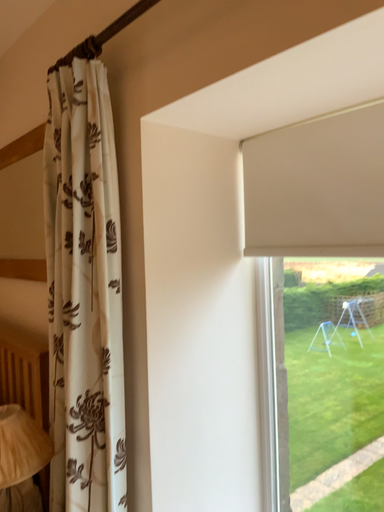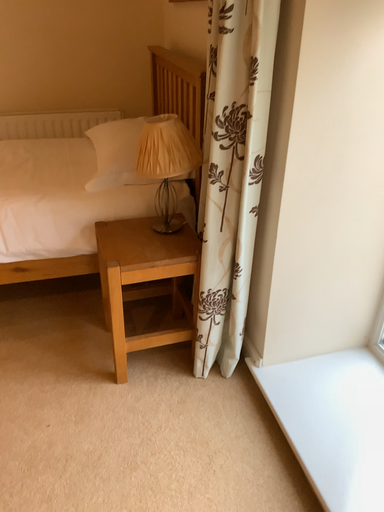
Question: How did the camera likely rotate when shooting the video?

Choices:
 (A) rotated upward
 (B) rotated downward

Answer: (B)